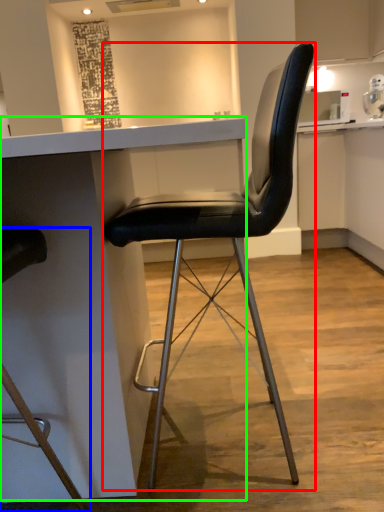
Question: Estimate the real-world distances between objects in this image. Which object is farther from chair (highlighted by a red box), chair (highlighted by a blue box) or table (highlighted by a green box)?

Choices:
 (A) chair
 (B) table

Answer: (A)